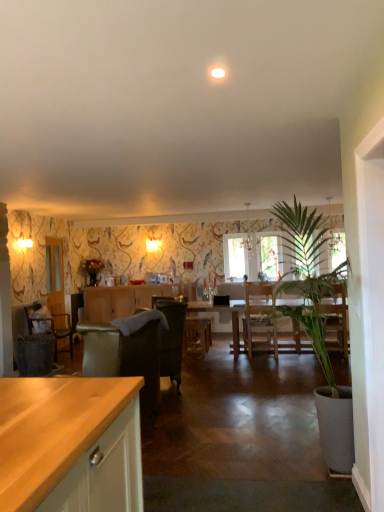
Question: Is velvet dark brown armchair at center, arranged as the 2th chair when viewed from the left, to the left of metallic chandelier at center from the viewer's perspective?

Choices:
 (A) yes
 (B) no

Answer: (A)

Question: Does velvet dark brown armchair at center, arranged as the 2th chair when viewed from the left, lie behind metallic chandelier at center?

Choices:
 (A) yes
 (B) no

Answer: (B)

Question: Can you confirm if velvet dark brown armchair at center, the 1th chair in the right-to-left sequence, is taller than metallic chandelier at center?

Choices:
 (A) yes
 (B) no

Answer: (A)

Question: Considering the relative sizes of velvet dark brown armchair at center, arranged as the 2th chair when viewed from the left, and metallic chandelier at center in the image provided, is velvet dark brown armchair at center, arranged as the 2th chair when viewed from the left, smaller than metallic chandelier at center?

Choices:
 (A) no
 (B) yes

Answer: (A)

Question: Could you tell me if velvet dark brown armchair at center, the 1th chair in the right-to-left sequence, is facing metallic chandelier at center?

Choices:
 (A) no
 (B) yes

Answer: (A)

Question: From the image's perspective, is metallic chandelier at center above or below velvet dark brown armchair at center, placed as the 2th chair when sorted from back to front?

Choices:
 (A) above
 (B) below

Answer: (A)

Question: Is metallic chandelier at center inside or outside of velvet dark brown armchair at center, placed as the 1th chair when sorted from front to back?

Choices:
 (A) outside
 (B) inside

Answer: (A)

Question: Is point (246, 234) closer or farther from the camera than point (160, 304)?

Choices:
 (A) closer
 (B) farther

Answer: (B)

Question: Is metallic chandelier at center wider or thinner than velvet dark brown armchair at center, placed as the 1th chair when sorted from front to back?

Choices:
 (A) wide
 (B) thin

Answer: (B)

Question: Is green leafy plant at right bigger or smaller than wooden cabinet at center?

Choices:
 (A) big
 (B) small

Answer: (A)

Question: Is green leafy plant at right in front of or behind wooden cabinet at center in the image?

Choices:
 (A) front
 (B) behind

Answer: (A)

Question: Looking at their shapes, would you say green leafy plant at right is wider or thinner than wooden cabinet at center?

Choices:
 (A) thin
 (B) wide

Answer: (B)

Question: From a real-world perspective, is green leafy plant at right positioned above or below wooden cabinet at center?

Choices:
 (A) below
 (B) above

Answer: (B)

Question: Looking at their shapes, would you say wooden chair at left, the second chair from the right, is wider or thinner than velvet dark brown armchair at center, placed as the 2th chair when sorted from back to front?

Choices:
 (A) wide
 (B) thin

Answer: (B)

Question: Is wooden chair at left, acting as the second chair starting from the front, bigger or smaller than velvet dark brown armchair at center, placed as the 2th chair when sorted from back to front?

Choices:
 (A) small
 (B) big

Answer: (A)